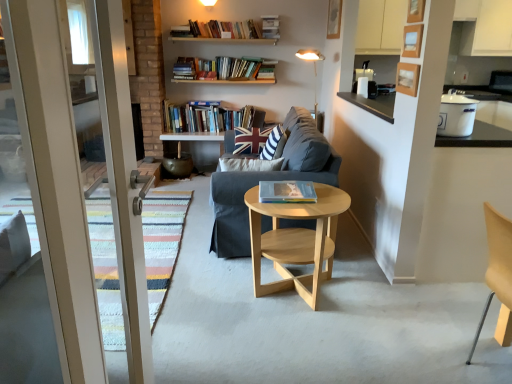
Locate an element on the screen. This screenshot has height=384, width=512. vacant space in front of light wood/woodenobject at center is located at coordinates (302, 348).